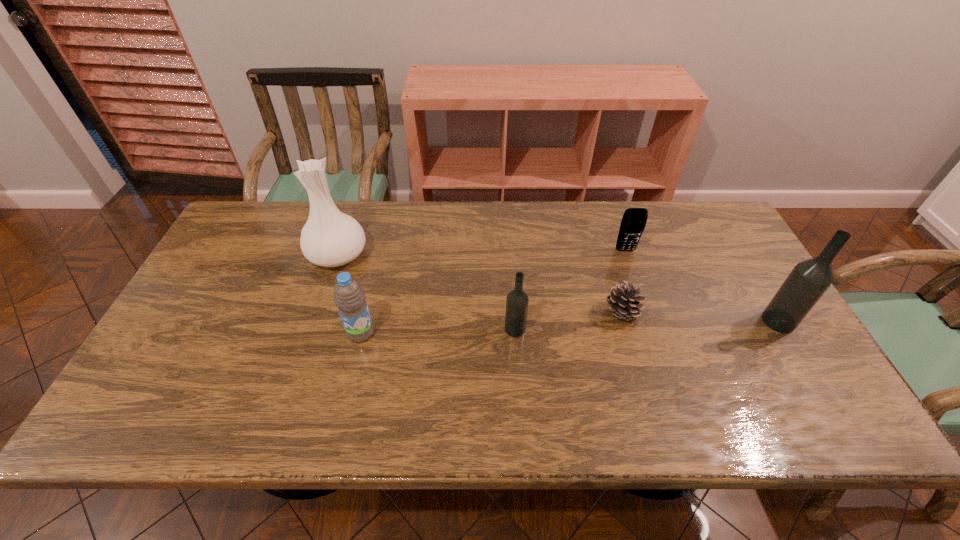
This screenshot has width=960, height=540. Identify the location of free region at the far left corner. point(250,245).

Locate an element on the screen. The image size is (960, 540). free space at the far right corner of the desktop is located at coordinates (715, 243).

The image size is (960, 540). I want to click on free space between the taller vodka and the shortest object, so click(x=700, y=317).

The width and height of the screenshot is (960, 540). I want to click on vacant space in between the taller vodka and the pinecone, so click(700, 317).

Identify the location of vacant space that is in between the water bottle and the rightmost object. Image resolution: width=960 pixels, height=540 pixels. (569, 327).

At what (x,y) coordinates should I click in order to perform the action: click on empty location between the left vodka and the water bottle. Please return your answer as a coordinate pair (x, y). Image resolution: width=960 pixels, height=540 pixels. Looking at the image, I should click on (438, 331).

Locate an element on the screen. vacant region between the water bottle and the fifth tallest object is located at coordinates (493, 292).

Where is `the closest object to the vase`? The image size is (960, 540). the closest object to the vase is located at coordinates (349, 297).

Select which object appears as the fourth closest to the shortest object. Please provide its 2D coordinates. Your answer should be formatted as a tuple, i.e. [(x, y)], where the tuple contains the x and y coordinates of a point satisfying the conditions above.

[(349, 297)]

I want to click on vacant space that satisfies the following two spatial constraints: 1. on the front side of the rightmost object; 2. on the right side of the vase, so click(316, 321).